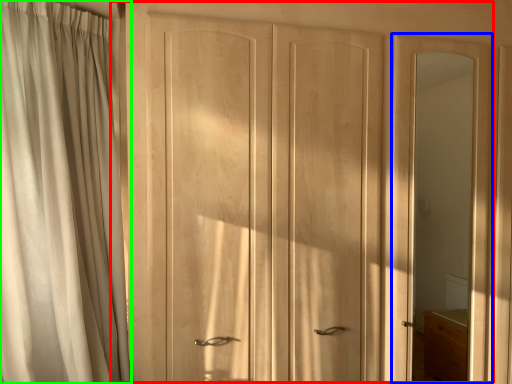
Question: Based on their relative distances, which object is nearer to door (highlighted by a red box)? Choose from screen door (highlighted by a blue box) and curtain (highlighted by a green box).

Choices:
 (A) screen door
 (B) curtain

Answer: (A)